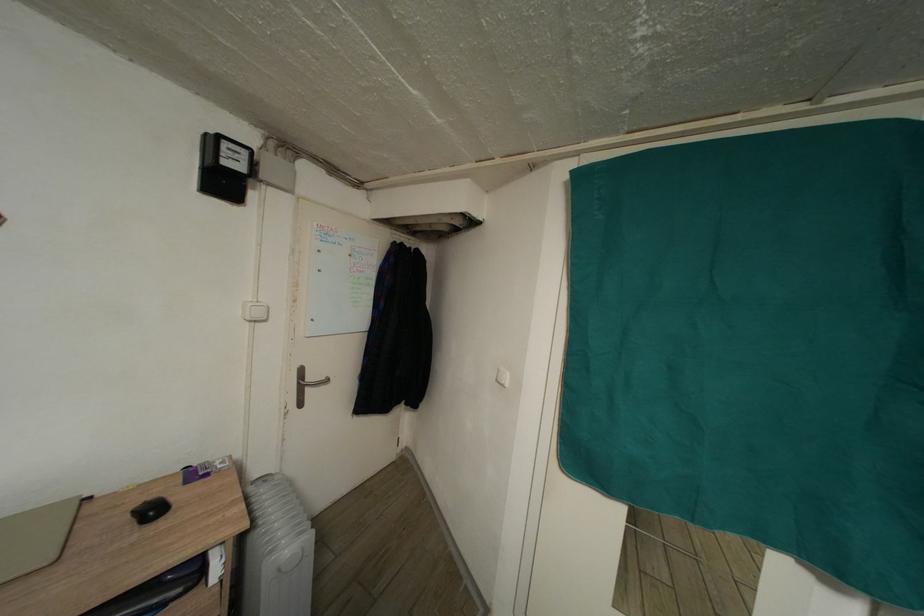
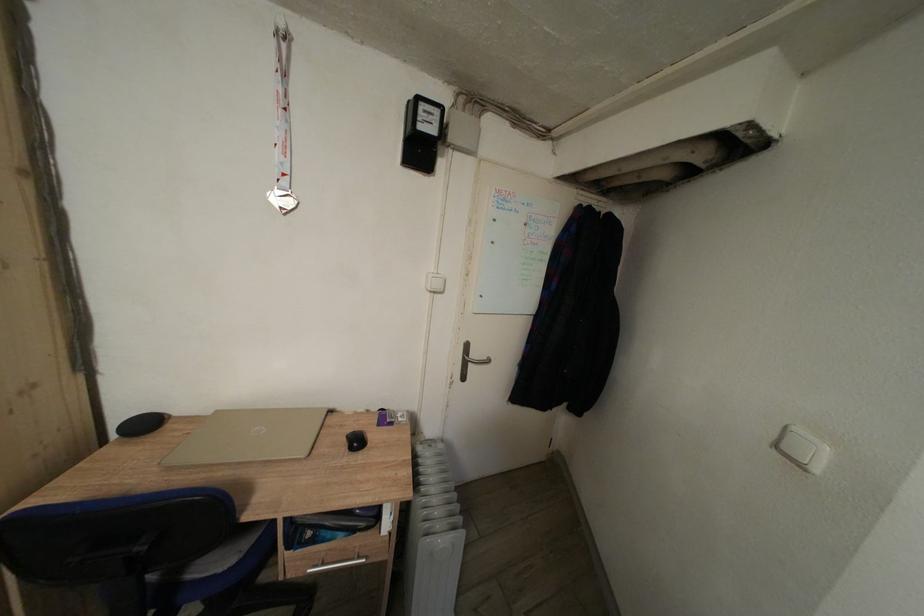
Question: How did the camera likely rotate?

Choices:
 (A) Left
 (B) Right
 (C) Up
 (D) Down

Answer: (A)